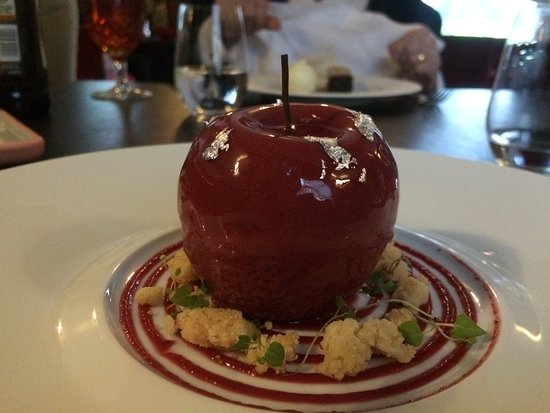
Find the location of a particular element. This screenshot has width=550, height=413. table is located at coordinates (76, 122).